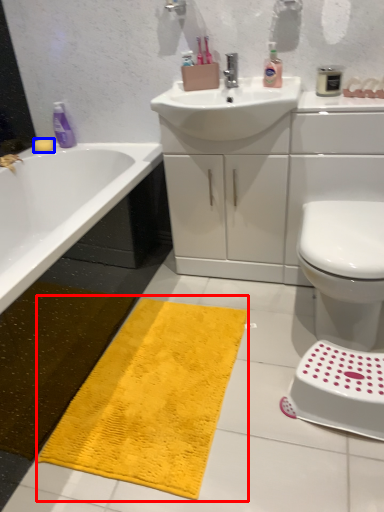
Question: Which of the following is the closest to the observer, bath mat (highlighted by a red box) or soap (highlighted by a blue box)?

Choices:
 (A) bath mat
 (B) soap

Answer: (A)